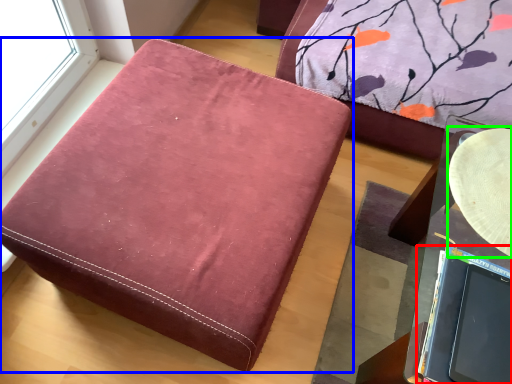
Question: Based on their relative distances, which object is farther from laptop (highlighted by a red box)? Choose from furniture (highlighted by a blue box) and round table (highlighted by a green box).

Choices:
 (A) furniture
 (B) round table

Answer: (A)